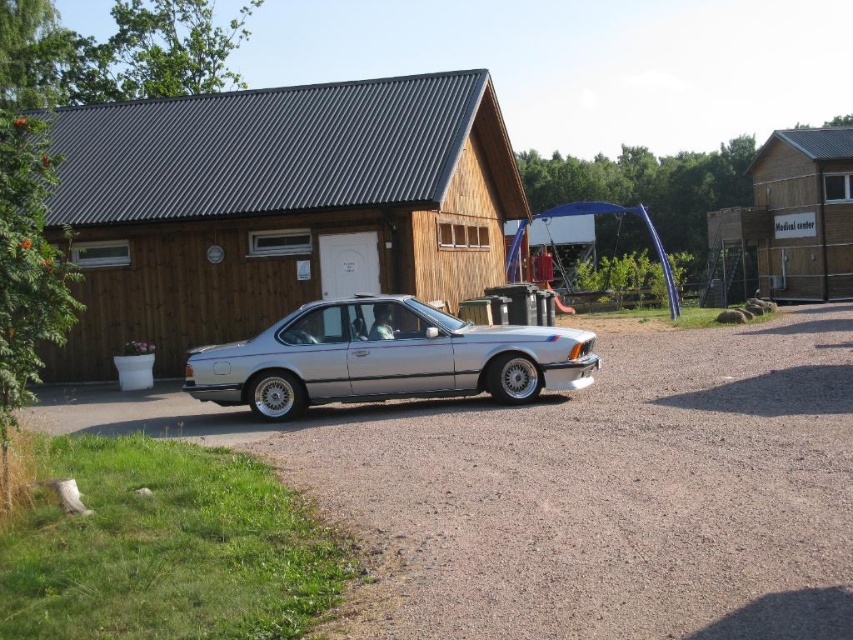
What are the coordinates of the silver metallic gravel at center?

The coordinates of the silver metallic gravel at center are at point (608, 493).